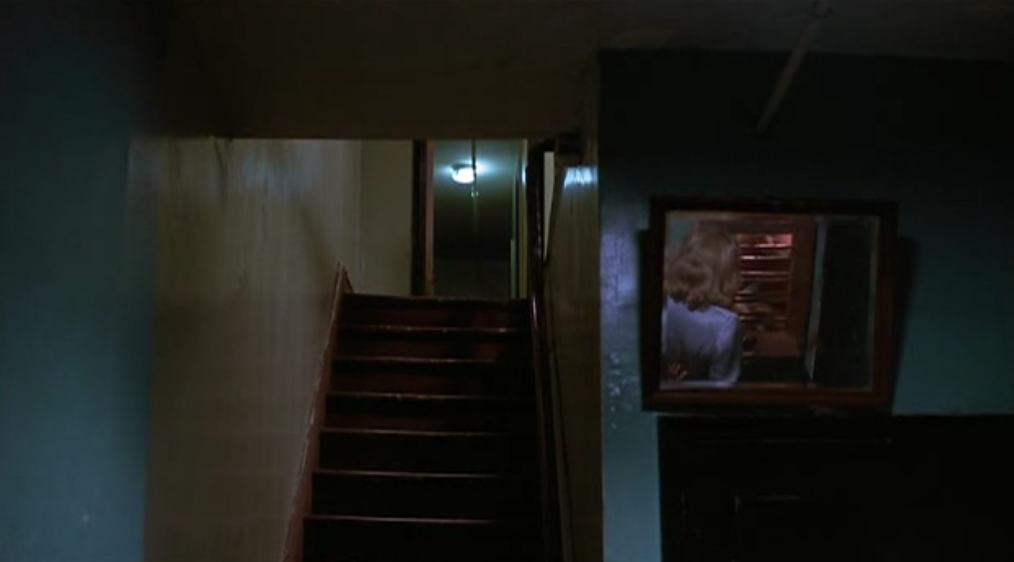
Identify the location of light. (465, 173).